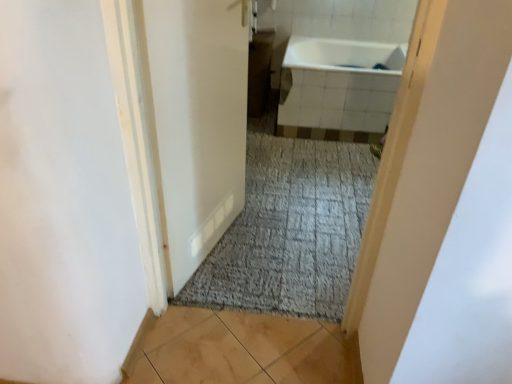
Image resolution: width=512 pixels, height=384 pixels. Describe the element at coordinates (194, 122) in the screenshot. I see `white glossy door at center` at that location.

Where is `white glossy door at center`? This screenshot has width=512, height=384. white glossy door at center is located at coordinates (194, 122).

What do you see at coordinates (339, 86) in the screenshot? I see `white glossy bathtub at upper center` at bounding box center [339, 86].

Identify the location of white glossy bathtub at upper center. Image resolution: width=512 pixels, height=384 pixels. click(x=339, y=86).

This screenshot has width=512, height=384. What are the coordinates of `light brown tile at lower center` in the screenshot? It's located at (239, 350).

The width and height of the screenshot is (512, 384). What are the coordinates of `tile that is below the white glossy bathtub at upper center (from the image's perspective)` in the screenshot? It's located at (239, 350).

From a real-world perspective, is white glossy bathtub at upper center located beneath light brown tile at lower center?

No, from a real-world perspective, white glossy bathtub at upper center is not below light brown tile at lower center.

From the image's perspective, is white glossy bathtub at upper center on top of light brown tile at lower center?

Yes, from the image's perspective, white glossy bathtub at upper center is above light brown tile at lower center.

Between light brown tile at lower center and white glossy door at center, which one has more height?

With more height is white glossy door at center.

Does point (290, 383) lie behind point (223, 218)?

That is False.

Looking at this image, is the surface of light brown tile at lower center in direct contact with white glossy door at center?

light brown tile at lower center and white glossy door at center are clearly separated.

Is light brown tile at lower center bigger or smaller than white glossy door at center?

light brown tile at lower center is smaller than white glossy door at center.

Is white glossy door at center at the left side of white glossy bathtub at upper center?

Correct, you'll find white glossy door at center to the left of white glossy bathtub at upper center.

From the image's perspective, which one is positioned higher, white glossy door at center or white glossy bathtub at upper center?

white glossy bathtub at upper center.

The image size is (512, 384). Find the location of `bathtub that is under the white glossy door at center (from a real-world perspective)`. bathtub that is under the white glossy door at center (from a real-world perspective) is located at coordinates (339, 86).

From a real-world perspective, which object stands above the other?

white glossy door at center, from a real-world perspective.

Is light brown tile at lower center bigger or smaller than white glossy bathtub at upper center?

Considering their sizes, light brown tile at lower center takes up less space than white glossy bathtub at upper center.

How distant is light brown tile at lower center from white glossy bathtub at upper center?

A distance of 5.96 feet exists between light brown tile at lower center and white glossy bathtub at upper center.

Considering the points (227, 340) and (355, 123), which point is in front, point (227, 340) or point (355, 123)?

Point (227, 340)

Considering the relative positions of light brown tile at lower center and white glossy bathtub at upper center in the image provided, is light brown tile at lower center to the left or to the right of white glossy bathtub at upper center?

Based on their positions, light brown tile at lower center is located to the left of white glossy bathtub at upper center.

Is the depth of white glossy door at center less than that of light brown tile at lower center?

Yes, white glossy door at center is in front of light brown tile at lower center.

From a real-world perspective, is white glossy door at center physically above light brown tile at lower center?

Correct, in the physical world, white glossy door at center is higher than light brown tile at lower center.

Is light brown tile at lower center at the back of white glossy door at center?

No, white glossy door at center is not facing the opposite direction of light brown tile at lower center.

Considering the sizes of objects white glossy bathtub at upper center and white glossy door at center in the image provided, who is bigger, white glossy bathtub at upper center or white glossy door at center?

white glossy bathtub at upper center.

How distant is white glossy bathtub at upper center from white glossy door at center?

white glossy bathtub at upper center and white glossy door at center are 1.31 meters apart.

Considering their positions, is white glossy bathtub at upper center located in front of or behind white glossy door at center?

In the image, white glossy bathtub at upper center appears behind white glossy door at center.

Which is behind, point (388, 110) or point (181, 46)?

The point (388, 110) is farther from the camera.

Locate an element on the screen. The image size is (512, 384). bathtub on the right of light brown tile at lower center is located at coordinates (339, 86).

I want to click on tile below the white glossy door at center (from the image's perspective), so click(x=239, y=350).

Considering their positions, is white glossy door at center positioned further to white glossy bathtub at upper center than light brown tile at lower center?

light brown tile at lower center.

Which object lies further to the anchor point white glossy bathtub at upper center, light brown tile at lower center or white glossy door at center?

light brown tile at lower center is positioned further to the anchor white glossy bathtub at upper center.

Considering their positions, is light brown tile at lower center positioned closer to white glossy door at center than white glossy bathtub at upper center?

Among the two, light brown tile at lower center is located nearer to white glossy door at center.

Considering their positions, is white glossy bathtub at upper center positioned closer to white glossy door at center than light brown tile at lower center?

light brown tile at lower center.

Looking at the image, which one is located closer to light brown tile at lower center, white glossy door at center or white glossy bathtub at upper center?

white glossy door at center.

Considering their positions, is white glossy bathtub at upper center positioned closer to light brown tile at lower center than white glossy door at center?

Result: white glossy door at center is positioned closer to the anchor light brown tile at lower center.

The width and height of the screenshot is (512, 384). In order to click on tile between white glossy door at center and white glossy bathtub at upper center in the front-back direction in this screenshot , I will do `click(239, 350)`.